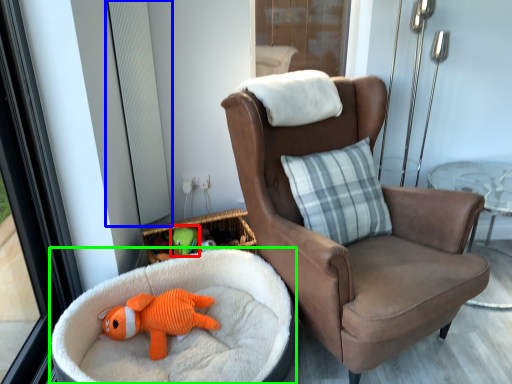
Question: Considering the real-world distances, which object is closest to toy (highlighted by a red box)? window screen (highlighted by a blue box) or dog bed (highlighted by a green box).

Choices:
 (A) window screen
 (B) dog bed

Answer: (B)